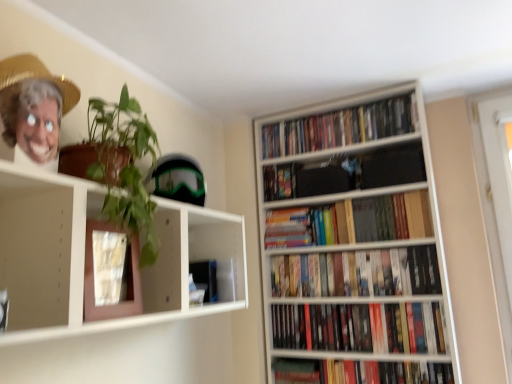
Locate an element on the screen. multicolored plastic toy at upper center, placed as the second book when sorted from top to bottom is located at coordinates click(x=280, y=181).

What do you see at coordinates (123, 166) in the screenshot? I see `green leafy plant at upper left` at bounding box center [123, 166].

What do you see at coordinates (341, 127) in the screenshot? I see `multicolored paperbacks at upper right, which appears as the 7th book when ordered from the bottom` at bounding box center [341, 127].

At what (x,y) coordinates should I click in order to perform the action: click on green matte plant at upper left. Please return your answer as a coordinate pair (x, y). Looking at the image, I should click on click(x=86, y=258).

What do you see at coordinates (360, 372) in the screenshot?
I see `hardcover book at lower right, acting as the 7th book starting from the top` at bounding box center [360, 372].

Identify the location of hardcover books at center, the 3th book when ordered from bottom to top. point(357,273).

Between green leafy plant at upper left and green matte plant at upper left, which one has smaller size?

green leafy plant at upper left is smaller.

What's the angular difference between green leafy plant at upper left and green matte plant at upper left's facing directions?

green leafy plant at upper left and green matte plant at upper left are facing 1.63 degrees away from each other.

Is point (136, 148) closer to camera compared to point (231, 234)?

Yes, point (136, 148) is in front of point (231, 234).

Is hardcover book at center, which is the fourth book in top-to-bottom order, bigger or smaller than multicolored plastic toy at upper center, the 6th book positioned from the bottom?

Considering their sizes, hardcover book at center, which is the fourth book in top-to-bottom order, takes up more space than multicolored plastic toy at upper center, the 6th book positioned from the bottom.

At what (x,y) coordinates should I click in order to perform the action: click on book behind the hardcover book at center, which is the fourth book in top-to-bottom order. Please return your answer as a coordinate pair (x, y). Image resolution: width=512 pixels, height=384 pixels. Looking at the image, I should click on (280, 181).

Which is farther from the camera, (x=265, y=236) or (x=288, y=197)?

The point (x=288, y=197) is farther from the camera.

Between hardcover book at center, which is the fourth book in top-to-bottom order, and multicolored plastic toy at upper center, the 6th book positioned from the bottom, which one has smaller width?

With smaller width is multicolored plastic toy at upper center, the 6th book positioned from the bottom.

Choose the correct answer: Is hardcover books at center, the 5th book viewed from the top, inside green matte plant at upper left or outside it?

hardcover books at center, the 5th book viewed from the top, is not inside green matte plant at upper left, it's outside.

The image size is (512, 384). Identify the location of shelf that is above the hardcover books at center, the 3th book when ordered from bottom to top (from the image's perspective). (86, 258).

Looking at this image, from the image's perspective, is hardcover books at center, the 5th book viewed from the top, located beneath green matte plant at upper left?

Correct, hardcover books at center, the 5th book viewed from the top, appears lower than green matte plant at upper left in the image.

Which is more to the right, hardcover books at center, the 3th book when ordered from bottom to top, or green matte plant at upper left?

Positioned to the right is hardcover books at center, the 3th book when ordered from bottom to top.

Considering the sizes of objects wooden bookshelf at right and hardcover book at lower right, the first book in the bottom-to-top sequence, in the image provided, who is smaller, wooden bookshelf at right or hardcover book at lower right, the first book in the bottom-to-top sequence,?

Smaller between the two is hardcover book at lower right, the first book in the bottom-to-top sequence.

Would you consider wooden bookshelf at right to be distant from hardcover book at lower right, the first book in the bottom-to-top sequence?

That's not correct — wooden bookshelf at right is a little close to hardcover book at lower right, the first book in the bottom-to-top sequence.

Would you say wooden bookshelf at right is outside hardcover book at lower right, the first book in the bottom-to-top sequence?

Absolutely, wooden bookshelf at right is external to hardcover book at lower right, the first book in the bottom-to-top sequence.

Which is more to the left, wooden bookshelf at right or hardcover book at lower right, acting as the 7th book starting from the top?

wooden bookshelf at right.

Would you say green leafy plant at upper left is inside or outside hardcover books at center, arranged as the third book when viewed from the top?

The correct answer is: outside.

Is green leafy plant at upper left to the left of hardcover books at center, placed as the 5th book when sorted from bottom to top, from the viewer's perspective?

Correct, you'll find green leafy plant at upper left to the left of hardcover books at center, placed as the 5th book when sorted from bottom to top.

Relative to hardcover books at center, placed as the 5th book when sorted from bottom to top, is green leafy plant at upper left in front or behind?

Clearly, green leafy plant at upper left is in front of hardcover books at center, placed as the 5th book when sorted from bottom to top.

Who is taller, green matte plant at upper left or hardcover books at center, the 5th book viewed from the top?

green matte plant at upper left.

From the image's perspective, is green matte plant at upper left over hardcover books at center, the 5th book viewed from the top?

Yes, from the image's perspective, green matte plant at upper left is over hardcover books at center, the 5th book viewed from the top.

Can you tell me how much green matte plant at upper left and hardcover books at center, the 5th book viewed from the top, differ in facing direction?

There is a 91-degree angle between the facing directions of green matte plant at upper left and hardcover books at center, the 5th book viewed from the top.

Looking at this image, which object is positioned more to the left, green matte plant at upper left or hardcover books at center, the 5th book viewed from the top?

green matte plant at upper left is more to the left.

What's the angular difference between hardcover book at center, positioned as the fourth book in bottom-to-top order, and hardcover books at center, arranged as the 6th book when viewed from the top,'s facing directions?

0.000576 degrees.

Considering the positions of point (319, 220) and point (397, 306), is point (319, 220) closer or farther from the camera than point (397, 306)?

Point (319, 220) appears to be farther away from the viewer than point (397, 306).

From the image's perspective, count 2nd books upward from the hardcover books at center, arranged as the 6th book when viewed from the top, and point to it. Please provide its 2D coordinates.

[(310, 226)]

Locate an element on the screen. houseplant behind the green matte plant at upper left is located at coordinates (123, 166).

From the image's perspective, count 2nd books downward from the multicolored plastic toy at upper center, the 6th book positioned from the bottom, and point to it. Please provide its 2D coordinates.

[(310, 226)]

Looking at the image, which one is located closer to hardcover books at center, the 5th book viewed from the top, multicolored plastic toy at upper center, the 6th book positioned from the bottom, or hardcover books at center, arranged as the third book when viewed from the top?

hardcover books at center, arranged as the third book when viewed from the top, lies closer to hardcover books at center, the 5th book viewed from the top, than the other object.

Which object lies nearer to the anchor point hardcover book at lower right, acting as the 7th book starting from the top, hardcover books at center, placed as the 5th book when sorted from bottom to top, or wooden bookshelf at right?

Among the two, wooden bookshelf at right is located nearer to hardcover book at lower right, acting as the 7th book starting from the top.

Estimate the real-world distances between objects in this image. Which object is closer to green matte plant at upper left, multicolored paperbacks at upper right, placed as the first book when sorted from top to bottom, or hardcover books at center, arranged as the third book when viewed from the top?

hardcover books at center, arranged as the third book when viewed from the top, is closer to green matte plant at upper left.

Considering their positions, is wooden bookshelf at right positioned further to hardcover book at lower right, acting as the 7th book starting from the top, than hardcover books at center, the 3th book when ordered from bottom to top?

wooden bookshelf at right is positioned further to the anchor hardcover book at lower right, acting as the 7th book starting from the top.

From the image, which object appears to be nearer to multicolored paperbacks at upper right, which appears as the 7th book when ordered from the bottom, hardcover books at center, the 2th book positioned from the bottom, or hardcover book at lower right, the first book in the bottom-to-top sequence?

The object closer to multicolored paperbacks at upper right, which appears as the 7th book when ordered from the bottom, is hardcover books at center, the 2th book positioned from the bottom.

When comparing their distances from hardcover books at center, the 5th book viewed from the top, does hardcover books at center, the 2th book positioned from the bottom, or hardcover books at center, placed as the 5th book when sorted from bottom to top, seem closer?

hardcover books at center, the 2th book positioned from the bottom.

Estimate the real-world distances between objects in this image. Which object is further from multicolored paperbacks at upper right, which appears as the 7th book when ordered from the bottom, hardcover book at lower right, acting as the 7th book starting from the top, or green matte plant at upper left?

Among the two, hardcover book at lower right, acting as the 7th book starting from the top, is located further to multicolored paperbacks at upper right, which appears as the 7th book when ordered from the bottom.

Considering their positions, is wooden bookshelf at right positioned closer to hardcover books at center, the 2th book positioned from the bottom, than hardcover book at lower right, acting as the 7th book starting from the top?

Based on the image, hardcover book at lower right, acting as the 7th book starting from the top, appears to be nearer to hardcover books at center, the 2th book positioned from the bottom.

The image size is (512, 384). Find the location of `houseplant located between green matte plant at upper left and wooden bookshelf at right in the left-right direction`. houseplant located between green matte plant at upper left and wooden bookshelf at right in the left-right direction is located at coordinates (123, 166).

This screenshot has height=384, width=512. Find the location of `bookcase between multicolored paperbacks at upper right, which appears as the 7th book when ordered from the bottom, and hardcover books at center, the 5th book viewed from the top, in the vertical direction`. bookcase between multicolored paperbacks at upper right, which appears as the 7th book when ordered from the bottom, and hardcover books at center, the 5th book viewed from the top, in the vertical direction is located at coordinates (355, 239).

Locate an element on the screen. Image resolution: width=512 pixels, height=384 pixels. bookcase between hardcover books at center, placed as the 5th book when sorted from bottom to top, and hardcover books at center, the 5th book viewed from the top, in the up-down direction is located at coordinates (355, 239).

This screenshot has width=512, height=384. What are the coordinates of `book between multicolored paperbacks at upper right, which appears as the 7th book when ordered from the bottom, and hardcover books at center, placed as the 5th book when sorted from bottom to top, from top to bottom` in the screenshot? It's located at (280, 181).